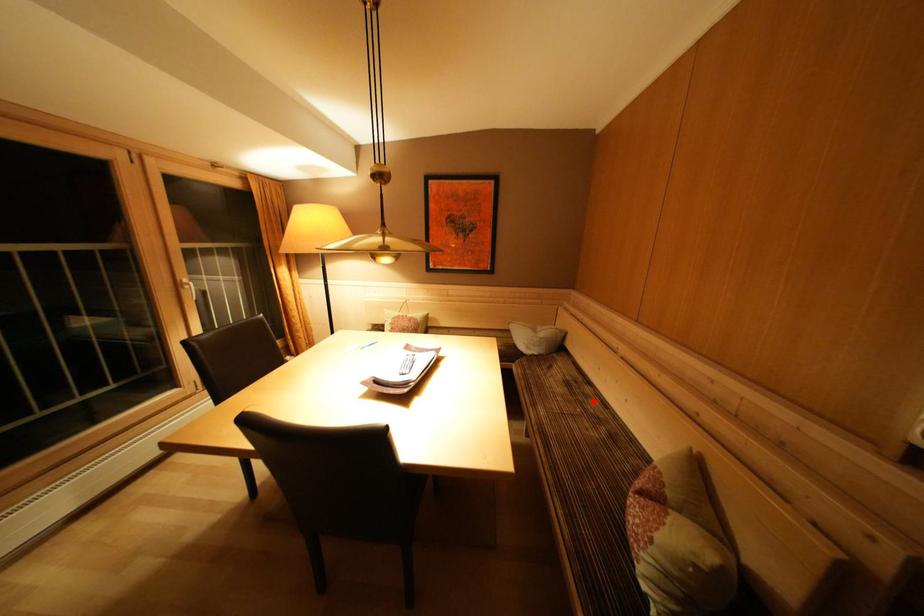
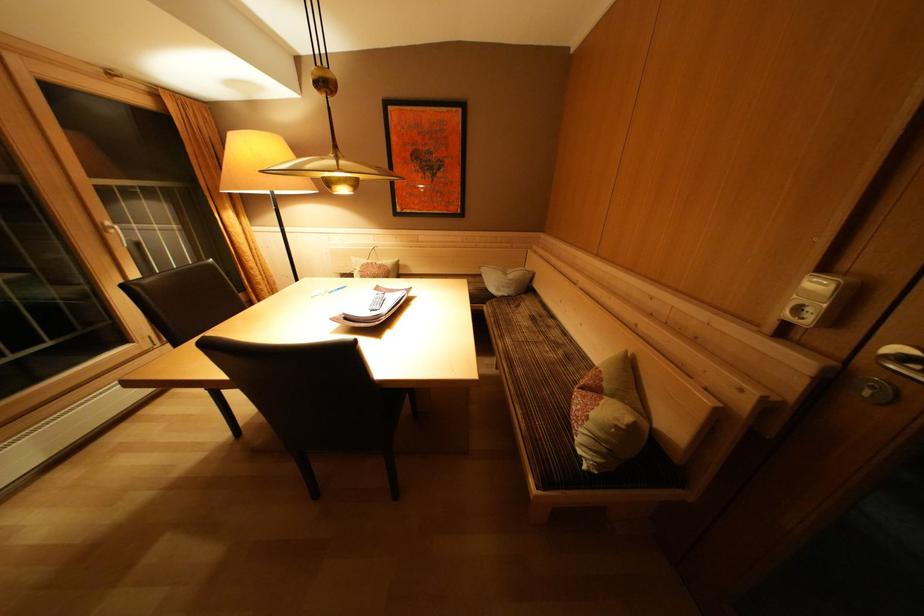
Locate, in the second image, the point that corresponds to the highlighted location in the first image.

(555, 331)